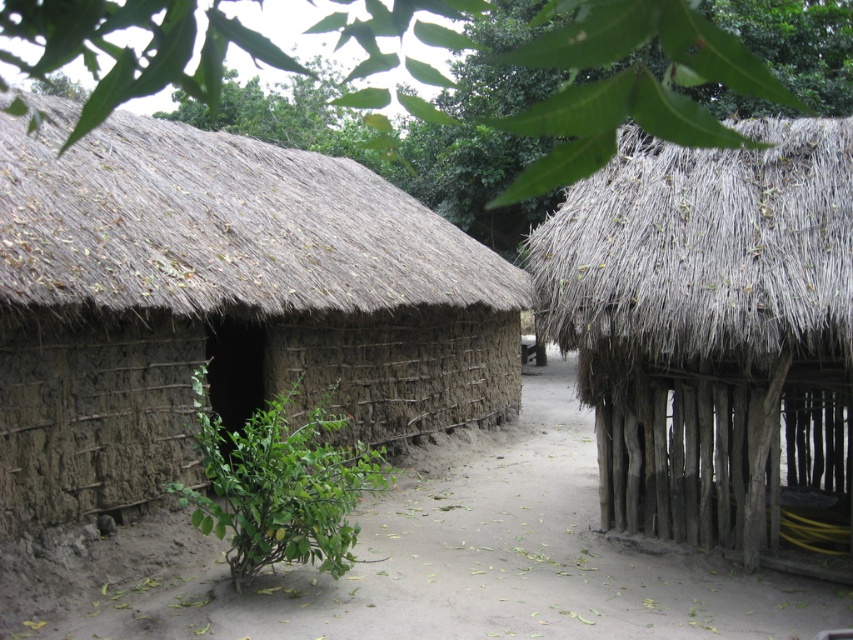
Question: Can you confirm if thatched straw hut at center is positioned to the left of brown thatch roof at left?

Choices:
 (A) yes
 (B) no

Answer: (B)

Question: Which point appears farthest from the camera in this image?

Choices:
 (A) (490, 259)
 (B) (808, 237)

Answer: (A)

Question: In this image, where is thatched straw hut at center located relative to brown thatch roof at left?

Choices:
 (A) left
 (B) right

Answer: (B)

Question: Observing the image, what is the correct spatial positioning of thatched straw hut at center in reference to brown thatch roof at left?

Choices:
 (A) above
 (B) below

Answer: (B)